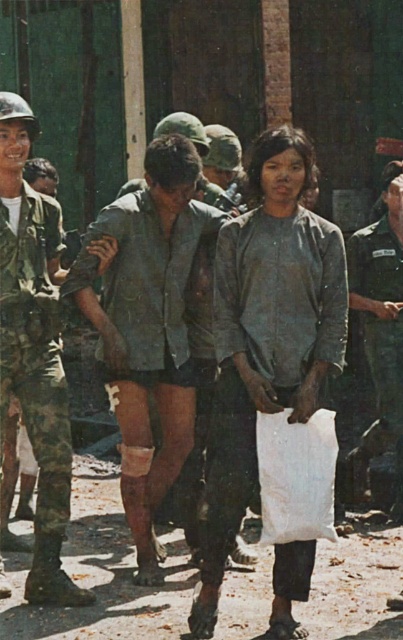
Question: Is gray cotton shirt at center positioned at the back of worn fabric shirt at center?

Choices:
 (A) yes
 (B) no

Answer: (B)

Question: Which of the following is the closest to the observer?

Choices:
 (A) (218, 465)
 (B) (33, 362)

Answer: (A)

Question: Observing the image, what is the correct spatial positioning of gray cotton shirt at center in reference to camouflage uniform at left?

Choices:
 (A) below
 (B) above

Answer: (A)

Question: Among these objects, which one is nearest to the camera?

Choices:
 (A) camouflage uniform at center
 (B) worn fabric shirt at center

Answer: (B)

Question: Which of these objects is positioned closest to the camouflage fabric shirt at center?

Choices:
 (A) gray cotton shirt at center
 (B) camouflage uniform at center
 (C) worn fabric shirt at center

Answer: (C)

Question: Is camouflage uniform at left positioned at the back of worn fabric shirt at center?

Choices:
 (A) yes
 (B) no

Answer: (B)